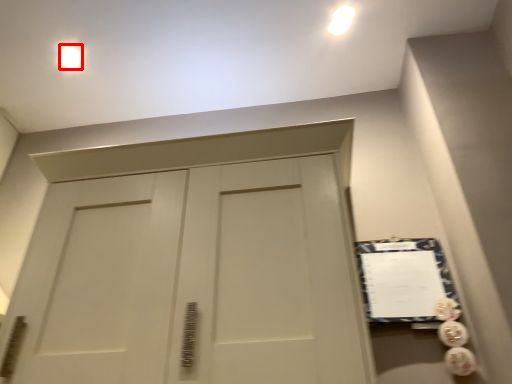
Question: From the image's perspective, where is lighting (annotated by the red box) located relative to bulletin board?

Choices:
 (A) below
 (B) above

Answer: (B)